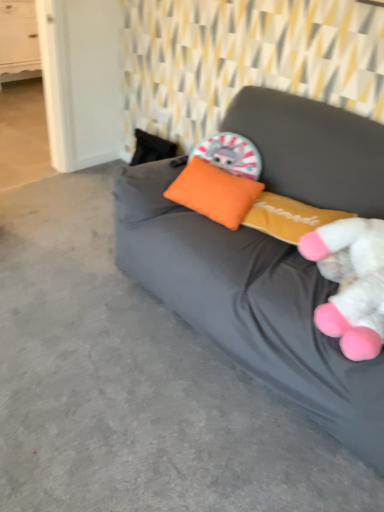
This screenshot has width=384, height=512. What do you see at coordinates (214, 192) in the screenshot?
I see `orange fabric pillow at center` at bounding box center [214, 192].

What do you see at coordinates (18, 32) in the screenshot? I see `white wood drawer at upper left` at bounding box center [18, 32].

The height and width of the screenshot is (512, 384). Find the location of `orange fabric pillow at center`. orange fabric pillow at center is located at coordinates (214, 192).

Which object is positioned more to the left, matte gray bean bag at center or white wood drawer at upper left?

white wood drawer at upper left.

Is matte gray bean bag at center thinner than white wood drawer at upper left?

No, matte gray bean bag at center is not thinner than white wood drawer at upper left.

Is white wood drawer at upper left inside matte gray bean bag at center?

No, white wood drawer at upper left is located outside of matte gray bean bag at center.

Does point (12, 34) lie behind point (227, 205)?

Yes, it is.

Which object is positioned more to the left, white wood drawer at upper left or orange fabric pillow at center?

white wood drawer at upper left is more to the left.

This screenshot has height=512, width=384. Identify the location of drawer located underneath the orange fabric pillow at center (from a real-world perspective). (18, 32).

From a real-world perspective, does white wood drawer at upper left sit lower than orange fabric pillow at center?

Yes, from a real-world perspective, white wood drawer at upper left is under orange fabric pillow at center.

Is orange fabric pillow at center far from white plush toy at right?

No, orange fabric pillow at center is in close proximity to white plush toy at right.

From a real-world perspective, is orange fabric pillow at center above or below white plush toy at right?

orange fabric pillow at center is below white plush toy at right.

Could you tell me if orange fabric pillow at center is turned towards white plush toy at right?

No, orange fabric pillow at center does not turn towards white plush toy at right.

Is white wood drawer at upper left to the right of matte gray bean bag at center from the viewer's perspective?

No, white wood drawer at upper left is not to the right of matte gray bean bag at center.

Considering the relative sizes of white wood drawer at upper left and matte gray bean bag at center in the image provided, is white wood drawer at upper left taller than matte gray bean bag at center?

Incorrect, the height of white wood drawer at upper left is not larger of that of matte gray bean bag at center.

Is white wood drawer at upper left bigger or smaller than matte gray bean bag at center?

In the image, white wood drawer at upper left appears to be smaller than matte gray bean bag at center.

Considering the relative sizes of white wood drawer at upper left and matte gray bean bag at center in the image provided, is white wood drawer at upper left wider than matte gray bean bag at center?

No, white wood drawer at upper left is not wider than matte gray bean bag at center.

From a real-world perspective, between orange fabric pillow at center and white wood drawer at upper left, who is vertically higher?

orange fabric pillow at center.

Identify the location of pillow in front of the white wood drawer at upper left. (214, 192).

What's the angular difference between orange fabric pillow at center and white wood drawer at upper left's facing directions?

80.4 degrees separate the facing orientations of orange fabric pillow at center and white wood drawer at upper left.

Is orange fabric pillow at center further to the viewer compared to white wood drawer at upper left?

That is False.

Is white wood drawer at upper left bigger than white plush toy at right?

Yes.

Looking at this image, is white wood drawer at upper left in contact with white plush toy at right?

No, white wood drawer at upper left is not beside white plush toy at right.

Is white wood drawer at upper left positioned behind white plush toy at right?

Yes, it is behind white plush toy at right.

Is white plush toy at right looking in the opposite direction of matte gray bean bag at center?

Correct, white plush toy at right is looking away from matte gray bean bag at center.

Which object is wider, white plush toy at right or matte gray bean bag at center?

Wider between the two is matte gray bean bag at center.

Are white plush toy at right and matte gray bean bag at center located far from each other?

They are positioned close to each other.

In terms of height, does white plush toy at right look taller or shorter compared to matte gray bean bag at center?

white plush toy at right is shorter than matte gray bean bag at center.

I want to click on drawer above the matte gray bean bag at center (from the image's perspective), so click(18, 32).

Image resolution: width=384 pixels, height=512 pixels. I want to click on pillow above the white wood drawer at upper left (from a real-world perspective), so click(214, 192).

Based on the photo, looking at the image, which one is located further to white wood drawer at upper left, white plush toy at right or matte gray bean bag at center?

white plush toy at right is further to white wood drawer at upper left.

When comparing their distances from white plush toy at right, does white wood drawer at upper left or orange fabric pillow at center seem closer?

orange fabric pillow at center is closer to white plush toy at right.

Which object lies nearer to the anchor point white plush toy at right, matte gray bean bag at center or white wood drawer at upper left?

Among the two, matte gray bean bag at center is located nearer to white plush toy at right.

Based on the photo, which object lies further to the anchor point white wood drawer at upper left, matte gray bean bag at center or orange fabric pillow at center?

matte gray bean bag at center is further to white wood drawer at upper left.

When comparing their distances from matte gray bean bag at center, does white plush toy at right or orange fabric pillow at center seem further?

orange fabric pillow at center lies further to matte gray bean bag at center than the other object.

Considering their positions, is orange fabric pillow at center positioned closer to white plush toy at right than matte gray bean bag at center?

Based on the image, matte gray bean bag at center appears to be nearer to white plush toy at right.

From the image, which object appears to be nearer to matte gray bean bag at center, orange fabric pillow at center or white plush toy at right?

white plush toy at right is closer to matte gray bean bag at center.

Which object lies further to the anchor point orange fabric pillow at center, white plush toy at right or matte gray bean bag at center?

Among the two, white plush toy at right is located further to orange fabric pillow at center.

Where is `toy between matte gray bean bag at center and white wood drawer at upper left from front to back`? Image resolution: width=384 pixels, height=512 pixels. toy between matte gray bean bag at center and white wood drawer at upper left from front to back is located at coordinates (351, 283).

At what (x,y) coordinates should I click in order to perform the action: click on pillow positioned between white plush toy at right and white wood drawer at upper left from near to far. Please return your answer as a coordinate pair (x, y). The width and height of the screenshot is (384, 512). Looking at the image, I should click on (214, 192).

Image resolution: width=384 pixels, height=512 pixels. I want to click on toy located between matte gray bean bag at center and orange fabric pillow at center in the depth direction, so 351,283.

At what (x,y) coordinates should I click in order to perform the action: click on pillow between matte gray bean bag at center and white wood drawer at upper left in the front-back direction. Please return your answer as a coordinate pair (x, y). The width and height of the screenshot is (384, 512). Looking at the image, I should click on coord(214,192).